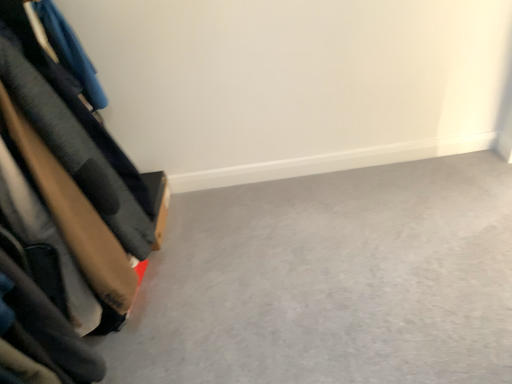
Question: Is velvet-like fabric couch at left at the left side of smooth gray carpet at lower left?

Choices:
 (A) no
 (B) yes

Answer: (B)

Question: Is the position of velvet-like fabric couch at left less distant than that of smooth gray carpet at lower left?

Choices:
 (A) yes
 (B) no

Answer: (A)

Question: From the image's perspective, is velvet-like fabric couch at left located beneath smooth gray carpet at lower left?

Choices:
 (A) no
 (B) yes

Answer: (A)

Question: From a real-world perspective, is velvet-like fabric couch at left over smooth gray carpet at lower left?

Choices:
 (A) no
 (B) yes

Answer: (B)

Question: Considering the relative sizes of velvet-like fabric couch at left and smooth gray carpet at lower left in the image provided, is velvet-like fabric couch at left thinner than smooth gray carpet at lower left?

Choices:
 (A) yes
 (B) no

Answer: (A)

Question: Would you consider velvet-like fabric couch at left to be distant from smooth gray carpet at lower left?

Choices:
 (A) no
 (B) yes

Answer: (A)

Question: From the image's perspective, does smooth gray carpet at lower left appear higher than velvet-like fabric couch at left?

Choices:
 (A) yes
 (B) no

Answer: (B)

Question: Considering the relative positions of smooth gray carpet at lower left and velvet-like fabric couch at left in the image provided, is smooth gray carpet at lower left to the left of velvet-like fabric couch at left from the viewer's perspective?

Choices:
 (A) no
 (B) yes

Answer: (A)

Question: Is smooth gray carpet at lower left thinner than velvet-like fabric couch at left?

Choices:
 (A) yes
 (B) no

Answer: (B)

Question: Considering the relative sizes of smooth gray carpet at lower left and velvet-like fabric couch at left in the image provided, is smooth gray carpet at lower left wider than velvet-like fabric couch at left?

Choices:
 (A) no
 (B) yes

Answer: (B)

Question: From a real-world perspective, is smooth gray carpet at lower left over velvet-like fabric couch at left?

Choices:
 (A) yes
 (B) no

Answer: (B)

Question: Is smooth gray carpet at lower left shorter than velvet-like fabric couch at left?

Choices:
 (A) no
 (B) yes

Answer: (B)

Question: Considering the relative positions of velvet-like fabric couch at left and smooth gray carpet at lower left in the image provided, is velvet-like fabric couch at left to the left or to the right of smooth gray carpet at lower left?

Choices:
 (A) left
 (B) right

Answer: (A)